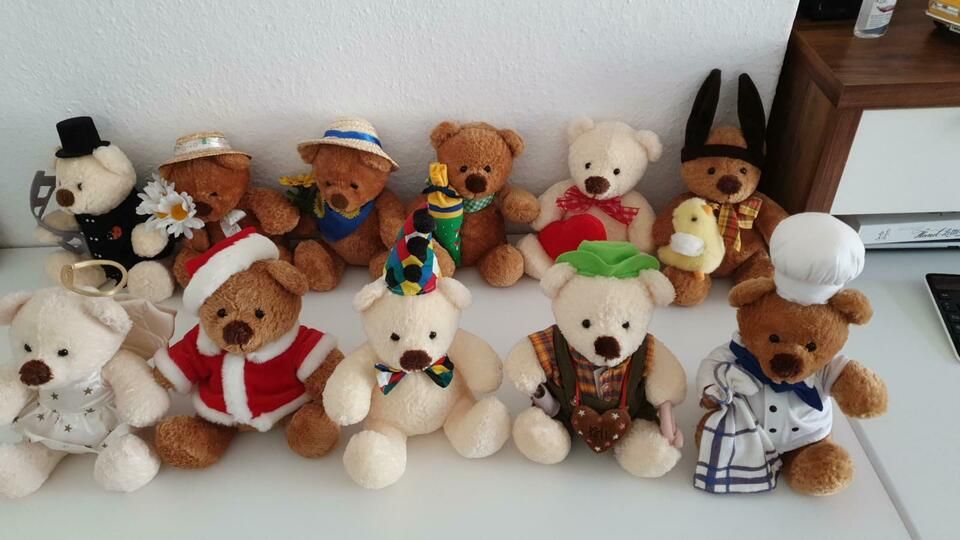
In order to click on teddy bears in this screenshot , I will do `click(69, 381)`, `click(255, 343)`, `click(214, 194)`, `click(98, 185)`, `click(370, 183)`, `click(413, 314)`, `click(592, 187)`, `click(706, 179)`, `click(797, 313)`.